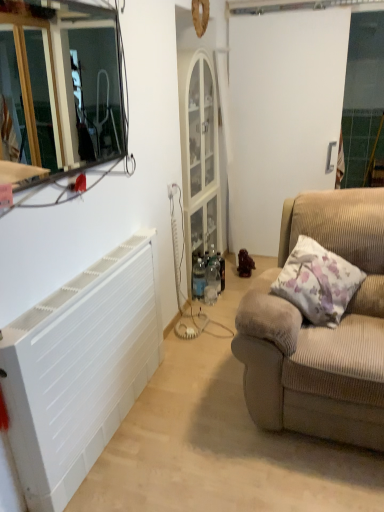
You are a GUI agent. You are given a task and a screenshot of the screen. Output one action in this format:
    pyautogui.click(x=<x>, y=<y>)
    Task: Click on the empty space that is ontop of white plastic radiator at left
    This screenshot has width=384, height=512.
    Given the screenshot: What is the action you would take?
    pyautogui.click(x=89, y=274)